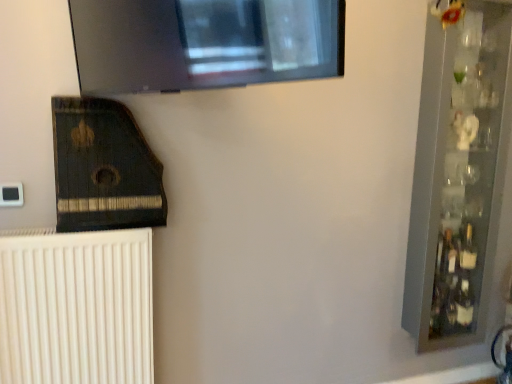
Question: Considering the relative sizes of white ribbed radiator at lower left and clear glass bottle at right in the image provided, is white ribbed radiator at lower left thinner than clear glass bottle at right?

Choices:
 (A) no
 (B) yes

Answer: (A)

Question: Is white ribbed radiator at lower left bigger than clear glass bottle at right?

Choices:
 (A) yes
 (B) no

Answer: (A)

Question: Is white ribbed radiator at lower left facing towards clear glass bottle at right?

Choices:
 (A) no
 (B) yes

Answer: (A)

Question: Is white ribbed radiator at lower left closer to camera compared to clear glass bottle at right?

Choices:
 (A) yes
 (B) no

Answer: (A)

Question: Is white ribbed radiator at lower left wider than clear glass bottle at right?

Choices:
 (A) yes
 (B) no

Answer: (A)

Question: Is white ribbed radiator at lower left shorter than clear glass bottle at right?

Choices:
 (A) yes
 (B) no

Answer: (B)

Question: Does dark wood harp at lower left appear on the right side of clear glass bottle at right?

Choices:
 (A) no
 (B) yes

Answer: (A)

Question: Would you consider dark wood harp at lower left to be distant from clear glass bottle at right?

Choices:
 (A) yes
 (B) no

Answer: (A)

Question: From a real-world perspective, is dark wood harp at lower left physically below clear glass bottle at right?

Choices:
 (A) yes
 (B) no

Answer: (B)

Question: Is dark wood harp at lower left looking in the opposite direction of clear glass bottle at right?

Choices:
 (A) no
 (B) yes

Answer: (A)

Question: Is dark wood harp at lower left behind clear glass bottle at right?

Choices:
 (A) yes
 (B) no

Answer: (B)

Question: Does dark wood harp at lower left have a greater width compared to clear glass bottle at right?

Choices:
 (A) yes
 (B) no

Answer: (A)

Question: Does dark wood harp at lower left come behind white ribbed radiator at lower left?

Choices:
 (A) yes
 (B) no

Answer: (B)